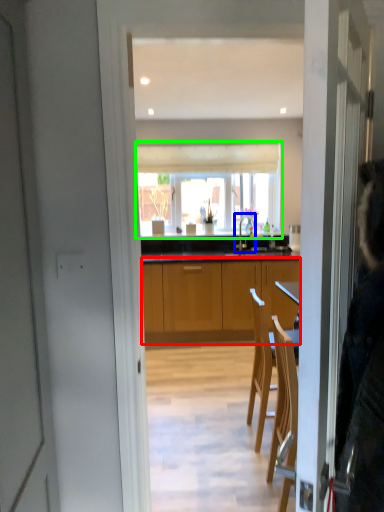
Question: Which object is the farthest from cabinetry (highlighted by a red box)? Choose among these: tap (highlighted by a blue box) or window (highlighted by a green box).

Choices:
 (A) tap
 (B) window

Answer: (B)